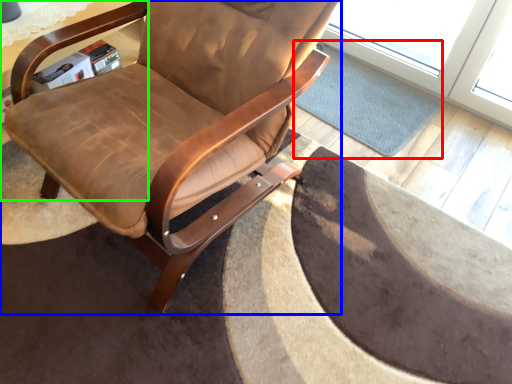
Question: Which object is positioned closest to mat (highlighted by a red box)? Select from chair (highlighted by a blue box) and table (highlighted by a green box).

Choices:
 (A) chair
 (B) table

Answer: (A)